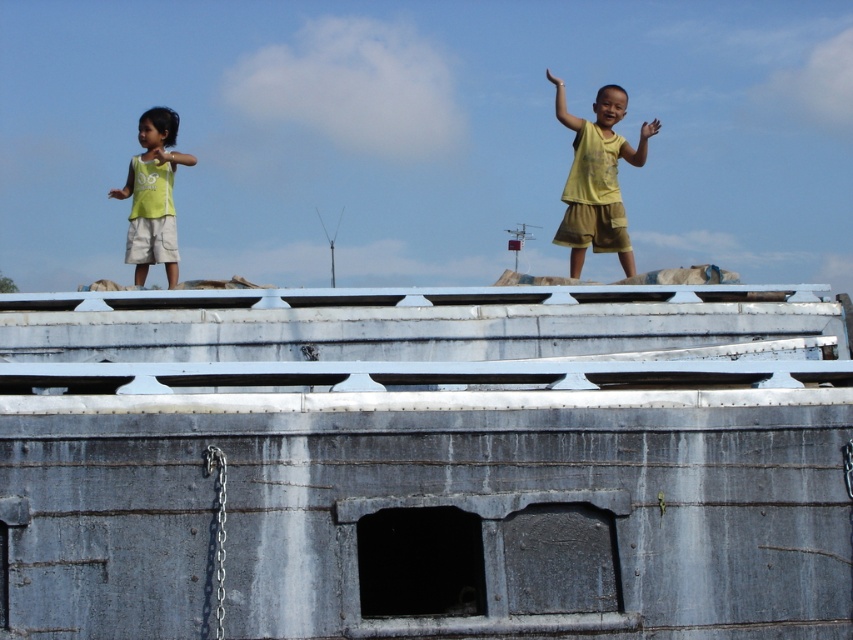
Question: Does yellow matte shirt at upper right have a lesser width compared to green matte shorts at left?

Choices:
 (A) yes
 (B) no

Answer: (A)

Question: Does yellow matte shirt at upper right have a smaller size compared to green matte shorts at left?

Choices:
 (A) no
 (B) yes

Answer: (B)

Question: Among these points, which one is farthest from the camera?

Choices:
 (A) (173, 166)
 (B) (606, 168)

Answer: (A)

Question: Does yellow matte shirt at upper right have a larger size compared to green matte shorts at left?

Choices:
 (A) yes
 (B) no

Answer: (B)